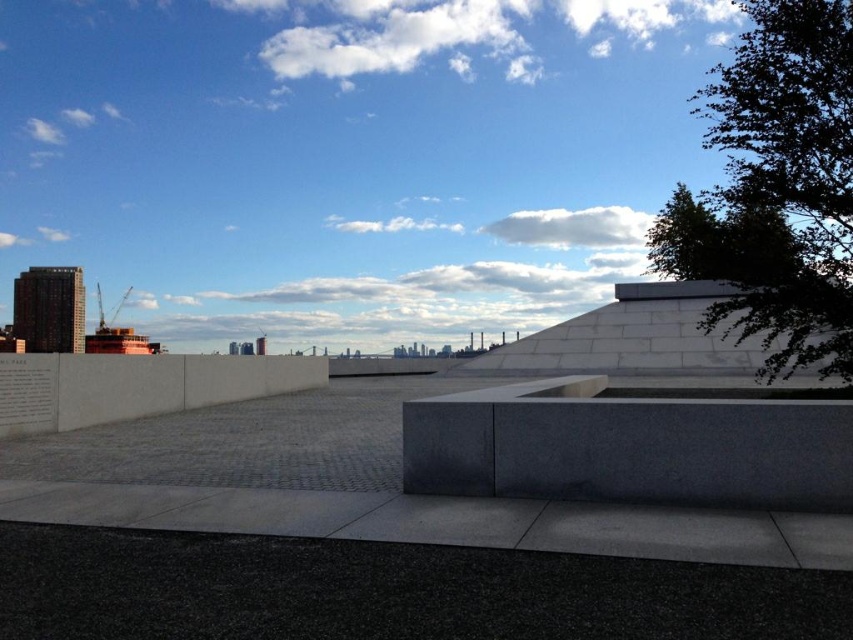
Question: Is gray granite ledge at center to the right of white concrete ledge at center from the viewer's perspective?

Choices:
 (A) yes
 (B) no

Answer: (A)

Question: Can you confirm if green leafy tree at upper right is positioned above gray granite ledge at center?

Choices:
 (A) no
 (B) yes

Answer: (B)

Question: Which object appears closest to the camera in this image?

Choices:
 (A) white concrete ledge at center
 (B) gray granite ledge at center

Answer: (B)

Question: Among these points, which one is farthest from the camera?

Choices:
 (A) (778, 109)
 (B) (553, 492)

Answer: (A)

Question: Can you confirm if gray granite ledge at center is thinner than white concrete ledge at center?

Choices:
 (A) yes
 (B) no

Answer: (A)

Question: Which object is positioned farthest from the gray granite ledge at center?

Choices:
 (A) green leafy tree at upper right
 (B) white concrete ledge at center

Answer: (A)